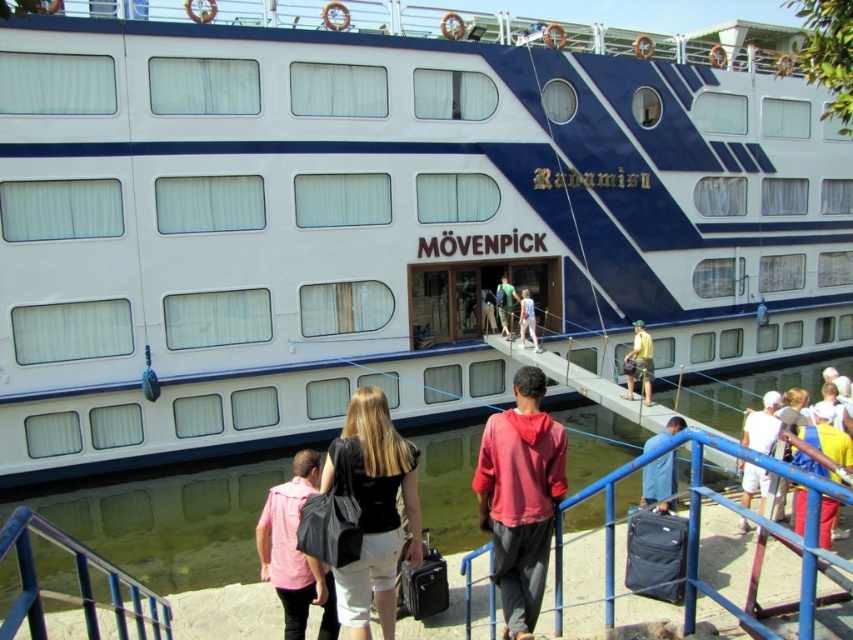
You are standing on the pier next to the cruise ship. You see a person wearing a yellow fabric shirt at center and light blue denim jeans at center. If you want to throw a ball to the person, will it travel more than 7 feet?

The distance between the yellow fabric shirt at center and light blue denim jeans at center is 7.30 feet, so the ball will travel more than 7 feet.

You are standing on the pier looking at the cruise ship. You notice two items at the center of your view. Which item is closer to you? The red matte hoodie at center or the yellow fabric shirt at center?

The red matte hoodie at center is closer to you because it is in front of the yellow fabric shirt at center.